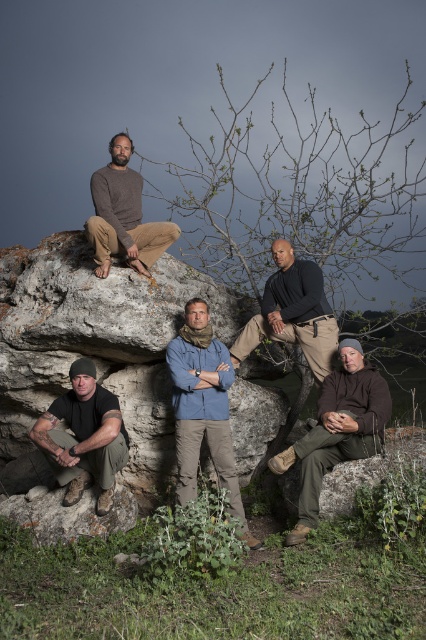
Question: Observing the image, what is the correct spatial positioning of black matte shirt at center in reference to matte brown pants at upper center?

Choices:
 (A) right
 (B) left

Answer: (A)

Question: Can you confirm if matte black t-shirt at lower left is thinner than matte brown pants at upper center?

Choices:
 (A) no
 (B) yes

Answer: (B)

Question: Estimate the real-world distances between objects in this image. Which object is closer to the blue fabric shirt at center?

Choices:
 (A) matte black t-shirt at lower left
 (B) brown woolen sweater at lower right
 (C) matte brown pants at upper center

Answer: (A)

Question: Observing the image, what is the correct spatial positioning of blue fabric shirt at center in reference to brown woolen sweater at lower right?

Choices:
 (A) above
 (B) below

Answer: (A)

Question: Which is nearer to the black matte shirt at center?

Choices:
 (A) matte black t-shirt at lower left
 (B) blue fabric shirt at center

Answer: (B)

Question: Estimate the real-world distances between objects in this image. Which object is farther from the matte brown pants at upper center?

Choices:
 (A) matte black t-shirt at lower left
 (B) black matte shirt at center
 (C) blue fabric shirt at center
 (D) brown woolen sweater at lower right

Answer: (D)